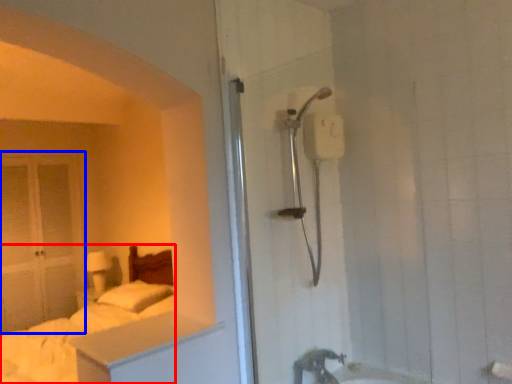
Question: Which point is further to the camera, bed (highlighted by a red box) or glass door (highlighted by a blue box)?

Choices:
 (A) bed
 (B) glass door

Answer: (B)